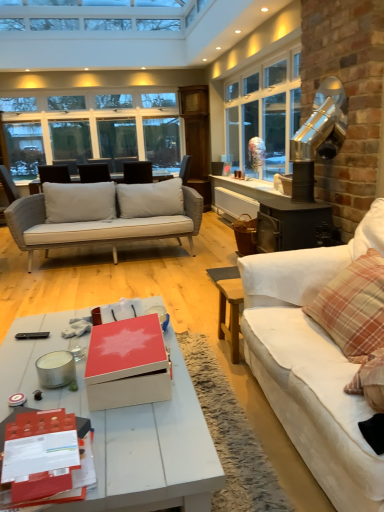
Question: Can you confirm if matte black chair at center is thinner than clear glass window at upper left?

Choices:
 (A) yes
 (B) no

Answer: (B)

Question: Is matte black chair at center turned away from clear glass window at upper left?

Choices:
 (A) no
 (B) yes

Answer: (A)

Question: Is matte black chair at center bigger than clear glass window at upper left?

Choices:
 (A) yes
 (B) no

Answer: (B)

Question: Can we say matte black chair at center lies outside clear glass window at upper left?

Choices:
 (A) yes
 (B) no

Answer: (A)

Question: Does matte black chair at center have a smaller size compared to clear glass window at upper left?

Choices:
 (A) no
 (B) yes

Answer: (B)

Question: Is black plastic remote control at lower left bigger or smaller than white fabric couch at right?

Choices:
 (A) small
 (B) big

Answer: (A)

Question: Looking at their shapes, would you say black plastic remote control at lower left is wider or thinner than white fabric couch at right?

Choices:
 (A) wide
 (B) thin

Answer: (B)

Question: Is black plastic remote control at lower left to the left or to the right of white fabric couch at right in the image?

Choices:
 (A) right
 (B) left

Answer: (B)

Question: In the image, is black plastic remote control at lower left positioned in front of or behind white fabric couch at right?

Choices:
 (A) front
 (B) behind

Answer: (B)

Question: Would you say black plastic remote control at lower left is inside or outside white painted wood coffee table at lower center?

Choices:
 (A) inside
 (B) outside

Answer: (A)

Question: In terms of width, does black plastic remote control at lower left look wider or thinner when compared to white painted wood coffee table at lower center?

Choices:
 (A) thin
 (B) wide

Answer: (A)

Question: From the image's perspective, is black plastic remote control at lower left located above or below white painted wood coffee table at lower center?

Choices:
 (A) below
 (B) above

Answer: (B)

Question: From a real-world perspective, is black plastic remote control at lower left positioned above or below white painted wood coffee table at lower center?

Choices:
 (A) below
 (B) above

Answer: (B)

Question: Is black plastic remote control at lower left inside or outside of clear glass window at upper left?

Choices:
 (A) outside
 (B) inside

Answer: (A)

Question: From the image's perspective, is black plastic remote control at lower left above or below clear glass window at upper left?

Choices:
 (A) below
 (B) above

Answer: (A)